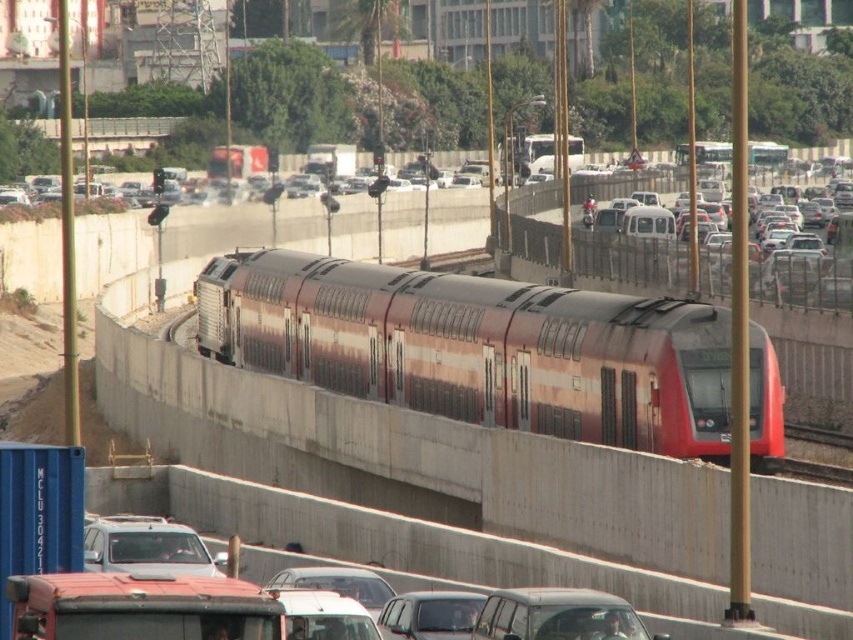
You are a city planner analyzing the layout of this urban area. The metallic red train at center is positioned at coordinates. Can you determine its exact coordinates based on the image?

The metallic red train at center is located at point (479, 348).